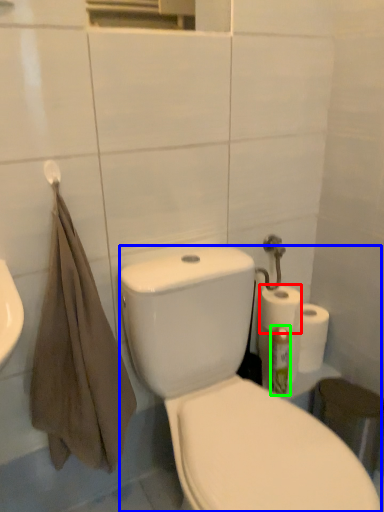
Question: Based on their relative distances, which object is farther from paper towel (highlighted by a red box)? Choose from porcelain (highlighted by a blue box) and cleaning product (highlighted by a green box).

Choices:
 (A) porcelain
 (B) cleaning product

Answer: (A)